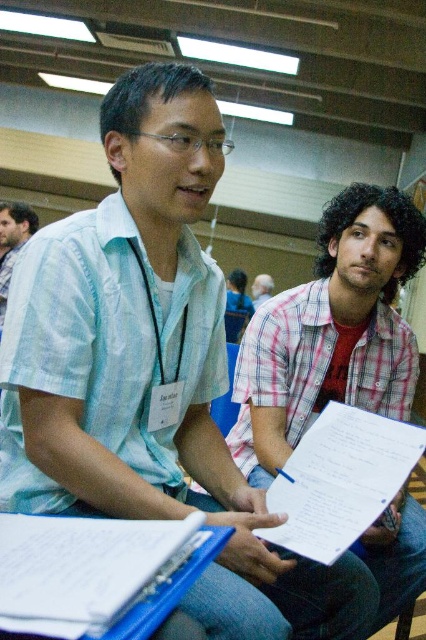
Does matte blue shirt at center have a larger size compared to light blue shirt at center?

No, matte blue shirt at center is not bigger than light blue shirt at center.

Where is `matte blue shirt at center`? This screenshot has width=426, height=640. matte blue shirt at center is located at coordinates (13, 241).

The height and width of the screenshot is (640, 426). I want to click on matte blue shirt at center, so click(x=13, y=241).

You are a GUI agent. You are given a task and a screenshot of the screen. Output one action in this format:
    pyautogui.click(x=<x>, y=<y>)
    Task: Click on the white paper at center
    
    Given the screenshot: What is the action you would take?
    pyautogui.click(x=339, y=481)

Based on the photo, can you confirm if white paper at center is thinner than matte blue shirt at center?

In fact, white paper at center might be wider than matte blue shirt at center.

Does point (305, 458) come behind point (5, 218)?

No, (305, 458) is closer to viewer.

Where is `white paper at center`? The image size is (426, 640). white paper at center is located at coordinates (339, 481).

Is pink checkered shirt at center positioned in front of light blue shirt at center?

Yes, pink checkered shirt at center is in front of light blue shirt at center.

Can you confirm if pink checkered shirt at center is smaller than light blue shirt at center?

No.

Who is more forward, (394,237) or (267,294)?

Positioned in front is point (394,237).

This screenshot has height=640, width=426. In order to click on pink checkered shirt at center in this screenshot , I will do `click(331, 332)`.